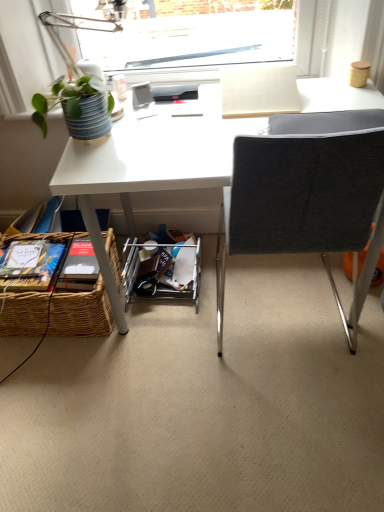
Question: Does matte white table lamp at upper left have a smaller size compared to green matte plant at upper left?

Choices:
 (A) yes
 (B) no

Answer: (B)

Question: Considering the relative sizes of matte white table lamp at upper left and green matte plant at upper left in the image provided, is matte white table lamp at upper left bigger than green matte plant at upper left?

Choices:
 (A) yes
 (B) no

Answer: (A)

Question: Is matte white table lamp at upper left completely or partially outside of green matte plant at upper left?

Choices:
 (A) no
 (B) yes

Answer: (B)

Question: From a real-world perspective, is matte white table lamp at upper left positioned over green matte plant at upper left based on gravity?

Choices:
 (A) no
 (B) yes

Answer: (B)

Question: Is matte white table lamp at upper left touching green matte plant at upper left?

Choices:
 (A) no
 (B) yes

Answer: (B)

Question: Do you think matte white table lamp at upper left is within green matte plant at upper left, or outside of it?

Choices:
 (A) inside
 (B) outside

Answer: (B)

Question: In the image, is matte white table lamp at upper left on the left side or the right side of green matte plant at upper left?

Choices:
 (A) left
 (B) right

Answer: (B)

Question: Is matte white table lamp at upper left in front of or behind green matte plant at upper left in the image?

Choices:
 (A) front
 (B) behind

Answer: (B)

Question: Is matte white table lamp at upper left wider or thinner than green matte plant at upper left?

Choices:
 (A) wide
 (B) thin

Answer: (A)

Question: In terms of size, does woven brown picnic basket at lower left appear bigger or smaller than dark gray fabric chair at center?

Choices:
 (A) big
 (B) small

Answer: (B)

Question: From the image's perspective, is woven brown picnic basket at lower left located above or below dark gray fabric chair at center?

Choices:
 (A) above
 (B) below

Answer: (B)

Question: Does point (87, 303) appear closer or farther from the camera than point (258, 176)?

Choices:
 (A) closer
 (B) farther

Answer: (B)

Question: Visually, is woven brown picnic basket at lower left positioned to the left or to the right of dark gray fabric chair at center?

Choices:
 (A) right
 (B) left

Answer: (B)

Question: In the image, is woven brown picnic basket at lower left on the left side or the right side of metal/mesh shelf at lower center?

Choices:
 (A) left
 (B) right

Answer: (A)

Question: Is point (102, 288) positioned closer to the camera than point (188, 262)?

Choices:
 (A) closer
 (B) farther

Answer: (A)